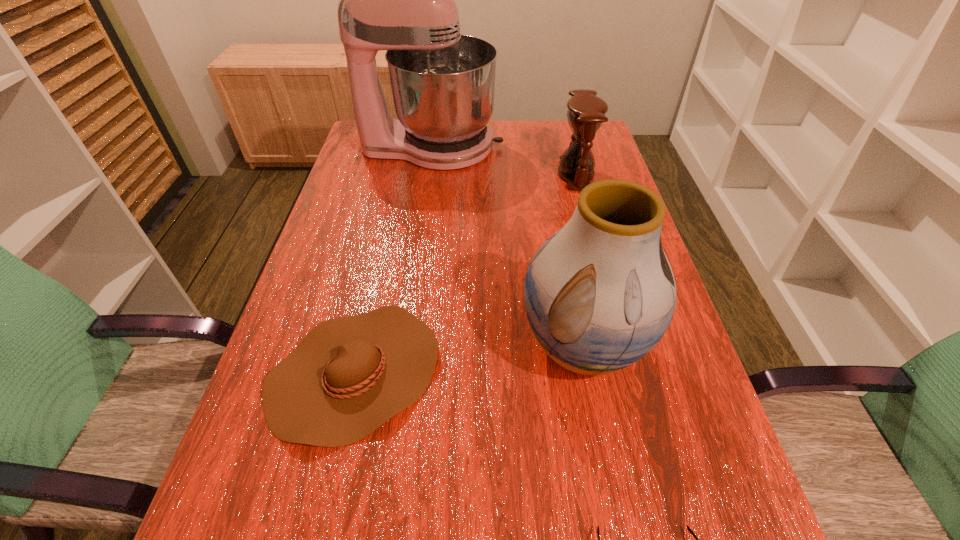
You are a GUI agent. You are given a task and a screenshot of the screen. Output one action in this format:
    pyautogui.click(x=<x>, y=<y>)
    Task: Click on the mixer
    The image size is (960, 540).
    Given the screenshot: What is the action you would take?
    pyautogui.click(x=402, y=0)

Identify the location of vase. The height and width of the screenshot is (540, 960). (600, 293).

You are a GUI agent. You are given a task and a screenshot of the screen. Output one action in this format:
    pyautogui.click(x=<x>, y=<y>)
    Task: Click on the hourglass
    
    Given the screenshot: What is the action you would take?
    pyautogui.click(x=586, y=112)

Locate an element on the screen. The height and width of the screenshot is (540, 960). the fourth tallest object is located at coordinates (349, 375).

I want to click on free spot located on the front-facing side of the tallest object, so click(528, 147).

Identify the location of vacant space situated on the left of the vase. This screenshot has height=540, width=960. (406, 347).

Where is `vacant position located on the left of the third tallest object`? This screenshot has width=960, height=540. vacant position located on the left of the third tallest object is located at coordinates (537, 174).

I want to click on vacant space located 0.160m on the back of the cowboy hat, so click(x=381, y=259).

Locate an element on the screen. mixer situated at the far edge is located at coordinates (402, 0).

Where is `hourglass located in the far edge section of the desktop`? This screenshot has height=540, width=960. hourglass located in the far edge section of the desktop is located at coordinates (586, 112).